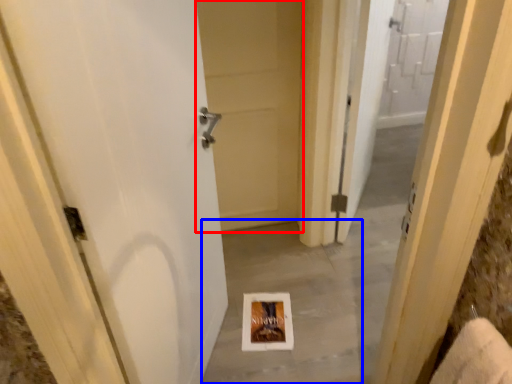
Question: Which of the following is the farthest to the observer, door (highlighted by a red box) or concrete (highlighted by a blue box)?

Choices:
 (A) door
 (B) concrete

Answer: (A)